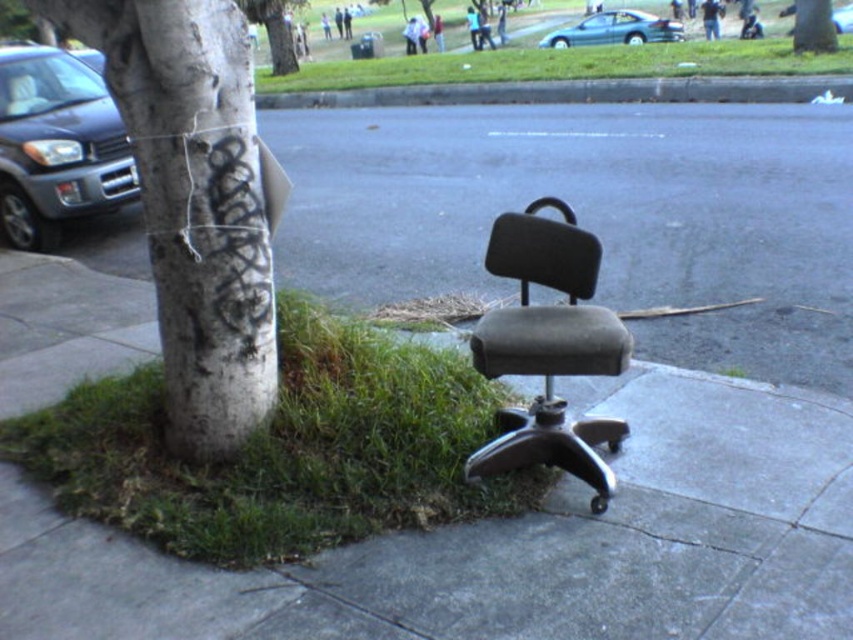
Based on the photo, you are a delivery robot navigating the sidewalk in the urban scene. You need to deliver a package to a location near the tree trunk. The gray rubber chair at center is in your path. Based on its position, can you safely navigate around it without hitting the chair?

The gray rubber chair at center is located at point (515,545). Since the chair is positioned near the edge of the sidewalk and slightly leaning against the tree, there should be enough space to navigate around it safely by moving closer to the opposite side of the sidewalk.

Looking at this image, you are a delivery person trying to navigate a narrow sidewalk. You see a gray rubber chair at center and a brushed metal suv at left. Which object is closer to the left edge of the sidewalk?

The brushed metal suv at left is closer to the left edge of the sidewalk because the gray rubber chair at center is positioned on the right side of it.

Please use the coordinate system where the bottom left corner is the origin. The gray rubber chair at center is located at which coordinate?

The gray rubber chair at center is located at coordinate point (x=515, y=545).